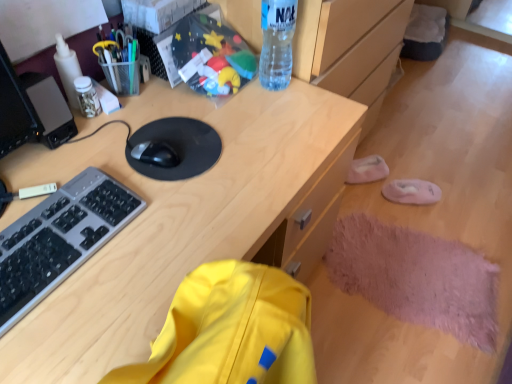
The width and height of the screenshot is (512, 384). Find the location of `vacant space that's between transparent plastic bottle at upper center, positioned as the first bottle in right-to-left order, and black matte mouse at center`. vacant space that's between transparent plastic bottle at upper center, positioned as the first bottle in right-to-left order, and black matte mouse at center is located at coordinates (218, 115).